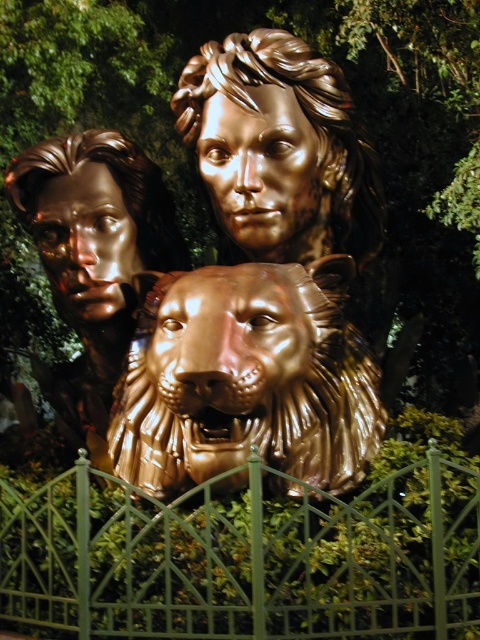
You are an art conservator examining the sculpture. You notice both the shiny bronze lion head at center and the gold polished head at center. Which one requires more frequent cleaning due to its material and visibility?

The shiny bronze lion head at center requires more frequent cleaning because it is larger in size than the gold polished head at center, making it more prone to collecting dust and requiring regular maintenance.

You are an art conservator assessing the sculpture. The green metal fence at center and the shiny gold head at center are both in your line of sight. Which object appears bigger to you?

The green metal fence at center is larger in size than the shiny gold head at center, so the green metal fence at center appears bigger.

You are an art conservator assessing the bronze sculpture. You notice the shiny gold lion at center and the shiny gold head at center. Which part of the sculpture requires more space to accommodate its size when planning storage?

The shiny gold lion at center requires more space because its width is larger than the shiny gold head at center.